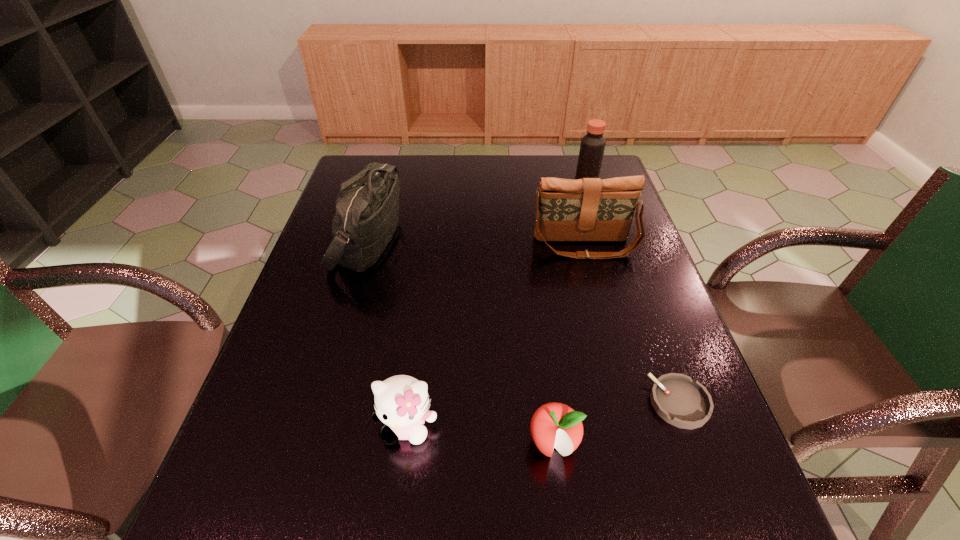
You are a GUI agent. You are given a task and a screenshot of the screen. Output one action in this format:
    pyautogui.click(x=<x>, y=<y>)
    Task: Click on the blank space located on the front-facing side of the right shoulder bag
    
    Given the screenshot: What is the action you would take?
    pyautogui.click(x=606, y=327)

Locate an element on the screen. The height and width of the screenshot is (540, 960). free space located 0.060m on the front-facing side of the fifth object from right to left is located at coordinates (399, 483).

Locate an element on the screen. The width and height of the screenshot is (960, 540). vacant space situated 0.210m on the right of the apple is located at coordinates (691, 443).

Where is `vacant space located on the back of the ashtray`? The width and height of the screenshot is (960, 540). vacant space located on the back of the ashtray is located at coordinates (637, 286).

This screenshot has height=540, width=960. Find the location of `object present at the far edge`. object present at the far edge is located at coordinates (592, 147).

This screenshot has height=540, width=960. In order to click on object that is at the left edge in this screenshot , I will do `click(367, 207)`.

You are a GUI agent. You are given a task and a screenshot of the screen. Output one action in this format:
    pyautogui.click(x=<x>, y=<y>)
    Task: Click on the vinegar that is positioned at the right edge
    Image resolution: width=960 pixels, height=540 pixels.
    Given the screenshot: What is the action you would take?
    592,147

Locate an element on the screen. Image resolution: width=960 pixels, height=540 pixels. shoulder bag present at the right edge is located at coordinates (589, 209).

Image resolution: width=960 pixels, height=540 pixels. I want to click on ashtray that is at the right edge, so click(x=682, y=402).

Identify the location of object situated at the far right corner. (592, 147).